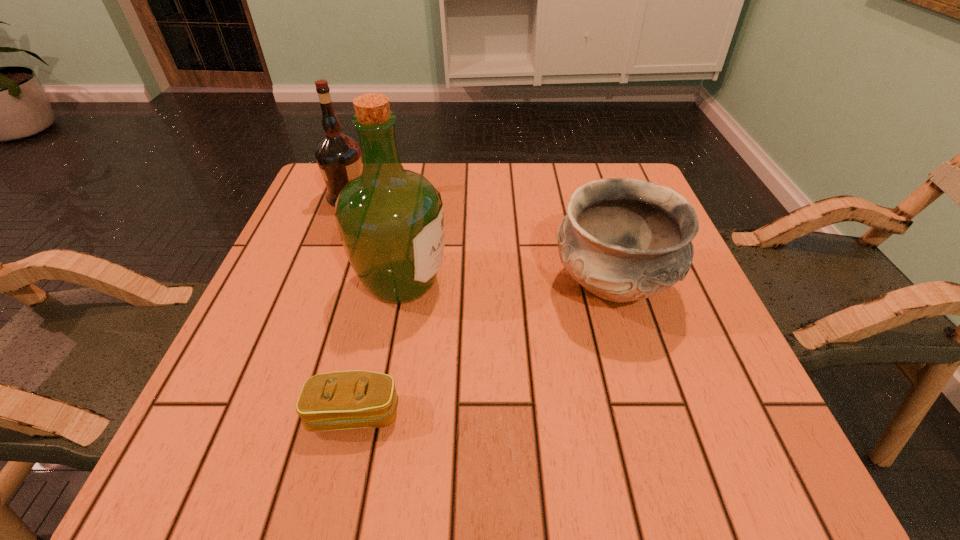
Locate an element on the screen. This screenshot has width=960, height=540. vacant region located on the left of the pottery is located at coordinates (442, 285).

Find the location of a particular element. object located in the far edge section of the desktop is located at coordinates (338, 156).

Image resolution: width=960 pixels, height=540 pixels. Find the location of `object that is at the near edge`. object that is at the near edge is located at coordinates 354,399.

This screenshot has width=960, height=540. I want to click on object present at the left edge, so click(338, 156).

Where is `object that is positioned at the right edge`? The width and height of the screenshot is (960, 540). object that is positioned at the right edge is located at coordinates (623, 240).

At what (x,y) coordinates should I click in order to perform the action: click on object positioned at the far left corner. Please return your answer as a coordinate pair (x, y). Image resolution: width=960 pixels, height=540 pixels. Looking at the image, I should click on (338, 156).

Image resolution: width=960 pixels, height=540 pixels. Find the location of `vacant space at the far edge of the desktop`. vacant space at the far edge of the desktop is located at coordinates coord(502,197).

In the image, there is a desktop. Where is `vacant space at the left edge`? vacant space at the left edge is located at coordinates (336, 287).

Identify the location of free space at the right edge of the desktop. This screenshot has height=540, width=960. [651, 388].

This screenshot has height=540, width=960. I want to click on free space at the near left corner, so click(x=198, y=444).